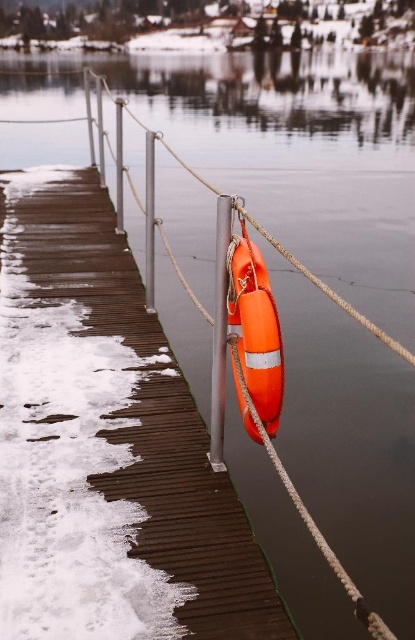
You are a park ranger standing at the edge of the dock. You need to locate the orange rubber lifebuoy at center. According to the coordinates provided, where should you look relative to the dock?

The orange rubber lifebuoy at center is located at coordinates 0.648 on the x axis and 0.357 on the y axis, which places it near the center of the dock.

You are standing on the dock and want to grab the orange rubber lifebuoy at center and the smooth gray pole at center. Which one is closer to your left side?

The orange rubber lifebuoy at center is to the left of smooth gray pole at center, so it is closer to your left side.

Based on the photo, you are standing at the edge of the dock and want to grab the orange rubber lifebuoy at center. Considering your arm can reach 1.5 meters, can you reach it without moving closer?

The orange rubber lifebuoy at center is 3.81 meters away from the viewer. Since your arm can only reach 1.5 meters, you cannot reach it without moving closer.